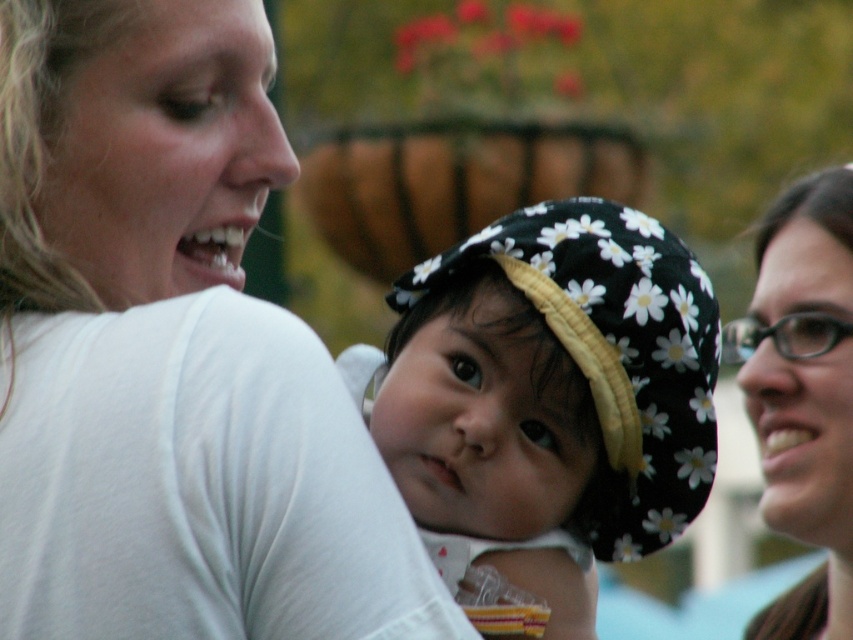
You are a photographer reviewing this image. You notice two points marked in the photo. The first point is at coordinate point(164,561) and the second is at point(799,378). Based on the depth of field, which point is closer to the camera?

Point(164,561) is closer to the viewer than point(799,378).

You are a photographer adjusting the camera settings to ensure both the white matte shirt at upper left and the floral fabric hat at center are in focus. Given their sizes, which object should you prioritize focusing on to ensure it appears sharp?

The white matte shirt at upper left is wider than the floral fabric hat at center, so you should prioritize focusing on the white matte shirt at upper left to ensure it appears sharp.